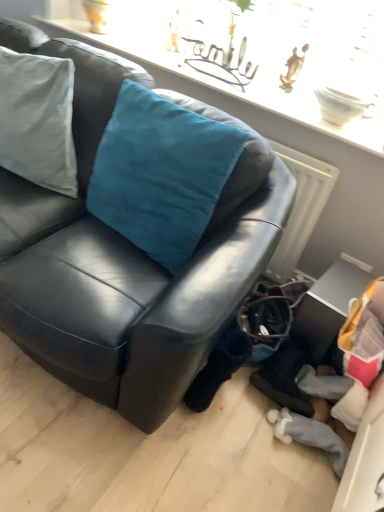
Measure the distance between point (179,174) and camera.

Point (179,174) is 4.53 feet away from camera.

What is the approximate height of satin teal cushion at upper center?

satin teal cushion at upper center is 4.59 centimeters in height.

Where is `teal velvet cushion at upper left`? teal velvet cushion at upper left is located at coordinates (160, 173).

Between black leather couch at center and satin teal cushion at upper center, which one is positioned behind?

satin teal cushion at upper center is more distant.

Is black leather couch at center with satin teal cushion at upper center?

black leather couch at center is not next to satin teal cushion at upper center, and they're not touching.

Is black leather couch at center inside or outside of satin teal cushion at upper center?

black leather couch at center cannot be found inside satin teal cushion at upper center.

Between black leather couch at center and satin teal cushion at upper center, which one appears on the left side from the viewer's perspective?

black leather couch at center is more to the left.

Is black leather couch at center looking in the opposite direction of teal velvet cushion at upper left?

Yes, teal velvet cushion at upper left is at the back of black leather couch at center.

Is black leather couch at center behind teal velvet cushion at upper left?

No, the depth of black leather couch at center is less than that of teal velvet cushion at upper left.

Does black leather couch at center contain teal velvet cushion at upper left?

Yes, teal velvet cushion at upper left is surrounded by black leather couch at center.

Measure the distance from black leather couch at center to teal velvet cushion at upper left.

A distance of 19.82 centimeters exists between black leather couch at center and teal velvet cushion at upper left.

Which point is more forward, (x=126, y=229) or (x=248, y=97)?

The point (x=126, y=229) is in front.

At what (x,y) coordinates should I click in order to perform the action: click on window sill above the teal velvet cushion at upper left (from a real-world perspective). Please return your answer as a coordinate pair (x, y). The width and height of the screenshot is (384, 512). Looking at the image, I should click on (256, 60).

Is teal velvet cushion at upper left positioned before satin teal cushion at upper center?

Yes, it is in front of satin teal cushion at upper center.

Does teal velvet cushion at upper left have a greater width compared to satin teal cushion at upper center?

In fact, teal velvet cushion at upper left might be narrower than satin teal cushion at upper center.

In the image, is metallic silver table at lower right on the left side or the right side of teal velvet cushion at upper left?

metallic silver table at lower right is positioned on teal velvet cushion at upper left's right side.

Considering the sizes of objects metallic silver table at lower right and teal velvet cushion at upper left in the image provided, who is smaller, metallic silver table at lower right or teal velvet cushion at upper left?

With smaller size is metallic silver table at lower right.

How many degrees apart are the facing directions of metallic silver table at lower right and teal velvet cushion at upper left?

8.29 degrees.

Which is further, (x=353, y=284) or (x=105, y=204)?

The point (x=353, y=284) is behind.

Could you tell me if teal velvet cushion at upper left is turned towards metallic silver table at lower right?

No, teal velvet cushion at upper left is not aimed at metallic silver table at lower right.

From their relative heights in the image, would you say teal velvet cushion at upper left is taller or shorter than metallic silver table at lower right?

Clearly, teal velvet cushion at upper left is taller compared to metallic silver table at lower right.

Considering the relative sizes of teal velvet cushion at upper left and metallic silver table at lower right in the image provided, is teal velvet cushion at upper left smaller than metallic silver table at lower right?

Incorrect, teal velvet cushion at upper left is not smaller in size than metallic silver table at lower right.

Does point (148, 94) appear closer or farther from the camera than point (343, 286)?

Point (148, 94) appears to be closer to the viewer than point (343, 286).

From the image's perspective, which one is positioned lower, teal velvet cushion at upper left or black leather couch at center?

black leather couch at center appears lower in the image.

Is black leather couch at center at the back of teal velvet cushion at upper left?

Yes, teal velvet cushion at upper left is facing away from black leather couch at center.

In the scene shown: From a real-world perspective, who is located higher, teal velvet cushion at upper left or black leather couch at center?

In real-world perspective, teal velvet cushion at upper left is above.

Identify the location of table that appears on the right of satin teal cushion at upper center. The image size is (384, 512). (328, 306).

Can you confirm if metallic silver table at lower right is smaller than satin teal cushion at upper center?

Yes, metallic silver table at lower right is smaller than satin teal cushion at upper center.

How different are the orientations of metallic silver table at lower right and satin teal cushion at upper center in degrees?

metallic silver table at lower right and satin teal cushion at upper center are facing 6 degrees away from each other.

Looking at this image, measure the distance from metallic silver table at lower right to satin teal cushion at upper center.

They are 33.96 inches apart.

What are the coordinates of `studio couch below the satin teal cushion at upper center (from a real-world perspective)` in the screenshot? It's located at (133, 285).

I want to click on throw pillow located above the black leather couch at center (from the image's perspective), so click(160, 173).

In the scene shown: Which object lies further to the anchor point teal velvet cushion at upper left, satin teal cushion at upper center or metallic silver table at lower right?

Among the two, satin teal cushion at upper center is located further to teal velvet cushion at upper left.

From the image, which object appears to be farther from black leather couch at center, teal velvet cushion at upper left or metallic silver table at lower right?

metallic silver table at lower right is positioned further to the anchor black leather couch at center.

From the image, which object appears to be farther from satin teal cushion at upper center, teal velvet cushion at upper left or black leather couch at center?

Among the two, black leather couch at center is located further to satin teal cushion at upper center.

When comparing their distances from teal velvet cushion at upper left, does metallic silver table at lower right or satin teal cushion at upper center seem further?

satin teal cushion at upper center.

Considering their positions, is black leather couch at center positioned closer to teal velvet cushion at upper left than metallic silver table at lower right?

black leather couch at center.

Looking at the image, which one is located further to metallic silver table at lower right, teal velvet cushion at upper left or satin teal cushion at upper center?

The object further to metallic silver table at lower right is satin teal cushion at upper center.

From the image, which object appears to be farther from black leather couch at center, teal velvet cushion at upper left or satin teal cushion at upper center?

satin teal cushion at upper center is further to black leather couch at center.

From the image, which object appears to be nearer to black leather couch at center, metallic silver table at lower right or teal velvet cushion at upper left?

Among the two, teal velvet cushion at upper left is located nearer to black leather couch at center.

The image size is (384, 512). Find the location of `throw pillow that lies between satin teal cushion at upper center and metallic silver table at lower right from top to bottom`. throw pillow that lies between satin teal cushion at upper center and metallic silver table at lower right from top to bottom is located at coordinates (160, 173).

This screenshot has height=512, width=384. I want to click on throw pillow situated between black leather couch at center and metallic silver table at lower right from left to right, so click(160, 173).

Locate an element on the screen. This screenshot has height=512, width=384. window sill between black leather couch at center and metallic silver table at lower right is located at coordinates (256, 60).

This screenshot has width=384, height=512. Find the location of `throw pillow located between black leather couch at center and satin teal cushion at upper center in the depth direction`. throw pillow located between black leather couch at center and satin teal cushion at upper center in the depth direction is located at coordinates (160, 173).